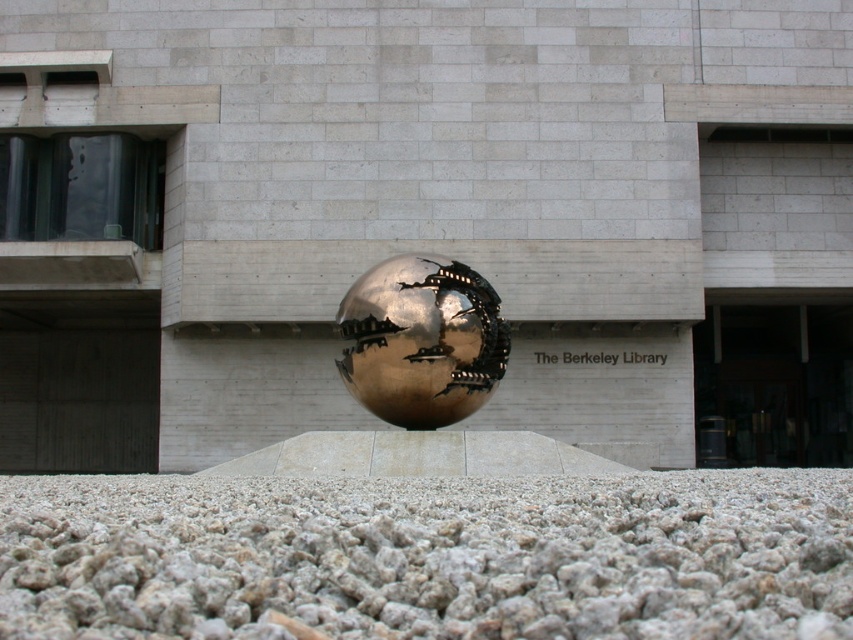
Question: Is gray gravel at lower center above gold metallic sphere at center?

Choices:
 (A) no
 (B) yes

Answer: (A)

Question: Which of the following is the closest to the observer?

Choices:
 (A) gray gravel at lower center
 (B) gold metallic sphere at center

Answer: (A)

Question: Which of the following is the farthest from the observer?

Choices:
 (A) (376, 333)
 (B) (614, 481)

Answer: (A)

Question: Which object is farther from the camera taking this photo?

Choices:
 (A) gold metallic sphere at center
 (B) gray gravel at lower center

Answer: (A)

Question: From the image, what is the correct spatial relationship of gray gravel at lower center in relation to gold metallic sphere at center?

Choices:
 (A) right
 (B) left

Answer: (B)

Question: Can you confirm if gray gravel at lower center is bigger than gold metallic sphere at center?

Choices:
 (A) no
 (B) yes

Answer: (A)